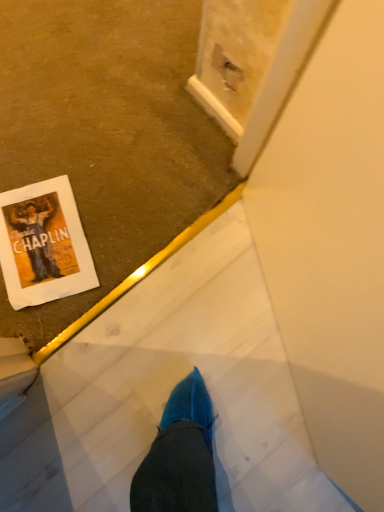
Locate an element on the screen. free point above white paper at lower left (from a real-world perspective) is located at coordinates (38, 238).